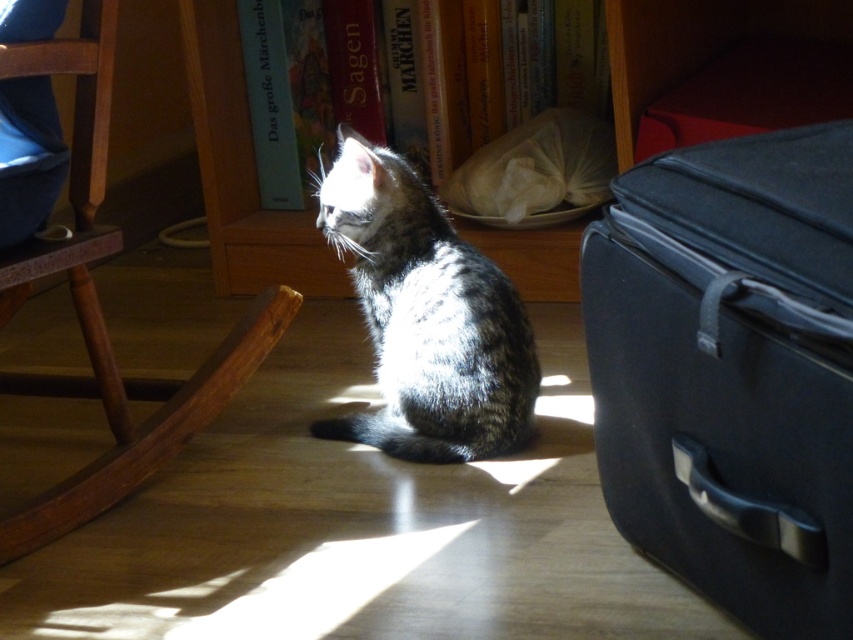
Does gray tabby cat at center have a greater width compared to wooden bookshelf at upper center?

No.

Which of these two, gray tabby cat at center or wooden bookshelf at upper center, stands shorter?

gray tabby cat at center is shorter.

Is point (438, 230) closer to camera compared to point (630, 148)?

Yes, it is in front of point (630, 148).

At what (x,y) coordinates should I click in order to perform the action: click on gray tabby cat at center. Please return your answer as a coordinate pair (x, y). The height and width of the screenshot is (640, 853). Looking at the image, I should click on (426, 317).

The height and width of the screenshot is (640, 853). What do you see at coordinates (730, 371) in the screenshot?
I see `matte black suitcase at right` at bounding box center [730, 371].

What do you see at coordinates (730, 371) in the screenshot?
I see `matte black suitcase at right` at bounding box center [730, 371].

Image resolution: width=853 pixels, height=640 pixels. Find the location of `matte black suitcase at right`. matte black suitcase at right is located at coordinates (730, 371).

This screenshot has height=640, width=853. Describe the element at coordinates (730, 371) in the screenshot. I see `matte black suitcase at right` at that location.

Can you confirm if matte black suitcase at right is positioned below wooden rocking chair at left?

Correct, matte black suitcase at right is located below wooden rocking chair at left.

Is point (711, 289) positioned after point (96, 160)?

No, it is in front of (96, 160).

At what (x,y) coordinates should I click in order to perform the action: click on matte black suitcase at right. Please return your answer as a coordinate pair (x, y). This screenshot has height=640, width=853. Looking at the image, I should click on (730, 371).